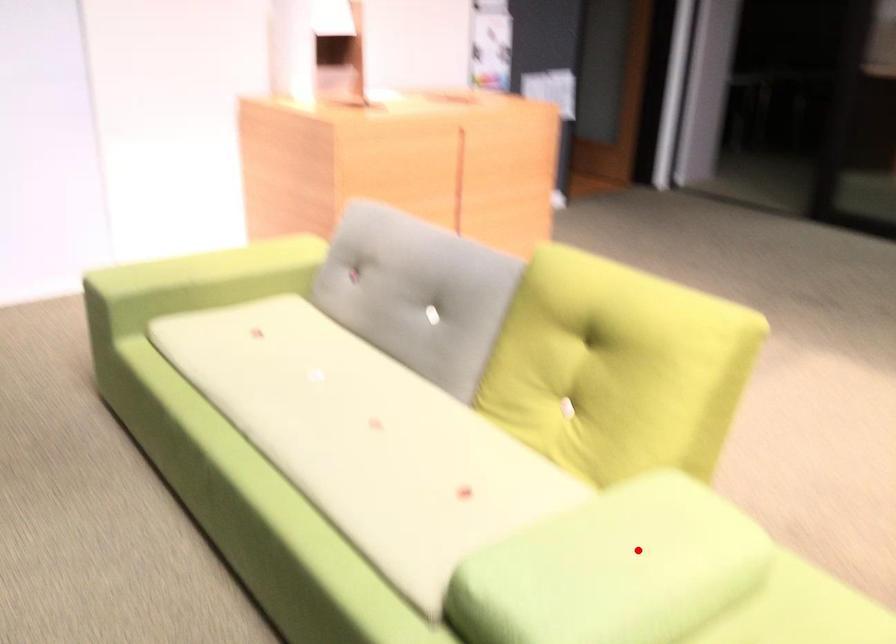
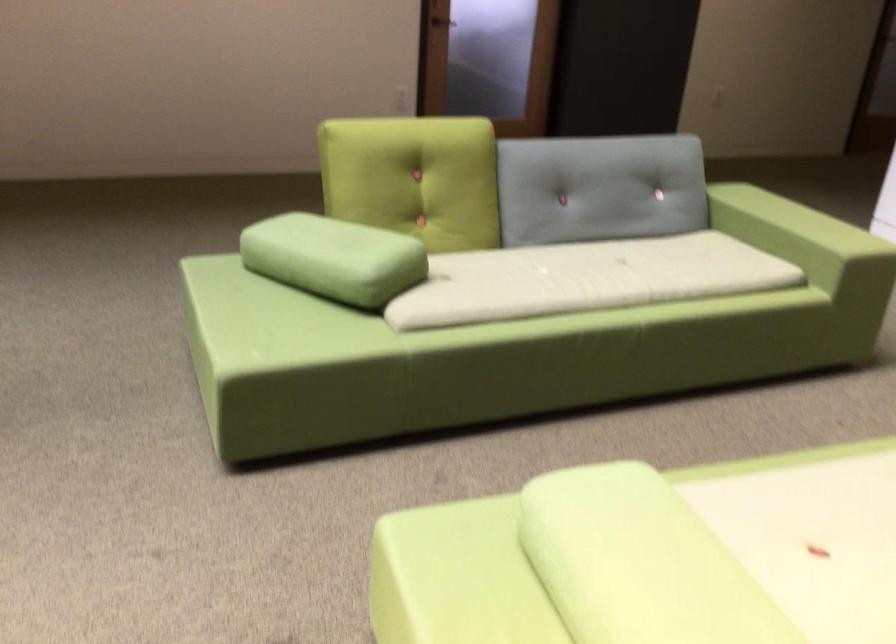
Question: A red point is marked in image1. In image2, is the corresponding 3D point closer to the camera or farther? Reply with the corresponding letter.

Choices:
 (A) The corresponding 3D point is closer.
 (B) The corresponding 3D point is farther.

Answer: (A)